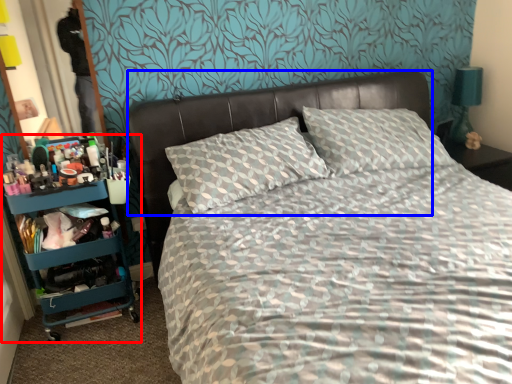
Question: Among these objects, which one is farthest to the camera, bookshelf (highlighted by a red box) or headboard (highlighted by a blue box)?

Choices:
 (A) bookshelf
 (B) headboard

Answer: (A)